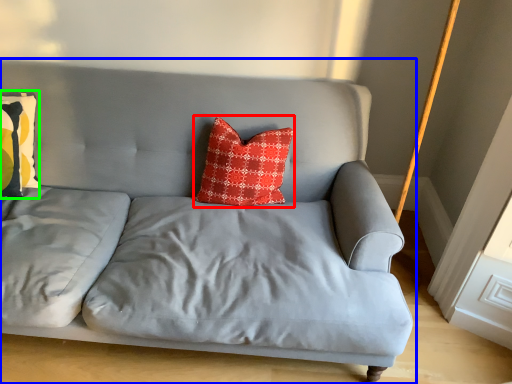
Question: Estimate the real-world distances between objects in this image. Which object is farther from pillow (highlighted by a red box), studio couch (highlighted by a blue box) or pillow (highlighted by a green box)?

Choices:
 (A) studio couch
 (B) pillow

Answer: (B)